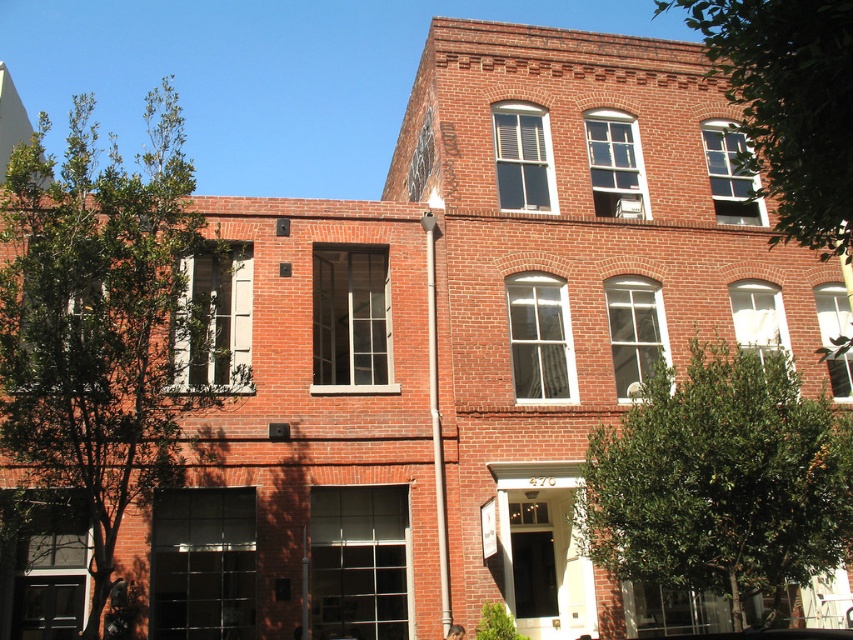
Question: Does green leafy tree at left have a larger size compared to green leafy tree at center?

Choices:
 (A) no
 (B) yes

Answer: (B)

Question: Which point is farther to the camera?

Choices:
 (A) (78, 342)
 (B) (755, 397)

Answer: (B)

Question: Among these points, which one is farthest from the camera?

Choices:
 (A) (820, 508)
 (B) (45, 445)
 (C) (799, 48)

Answer: (A)

Question: Among these points, which one is farthest from the camera?

Choices:
 (A) (61, 198)
 (B) (703, 26)

Answer: (A)

Question: Is green leafy tree at left above green leafy tree at center?

Choices:
 (A) yes
 (B) no

Answer: (A)

Question: Is green leafy tree at left above green leafy tree at center?

Choices:
 (A) no
 (B) yes

Answer: (B)